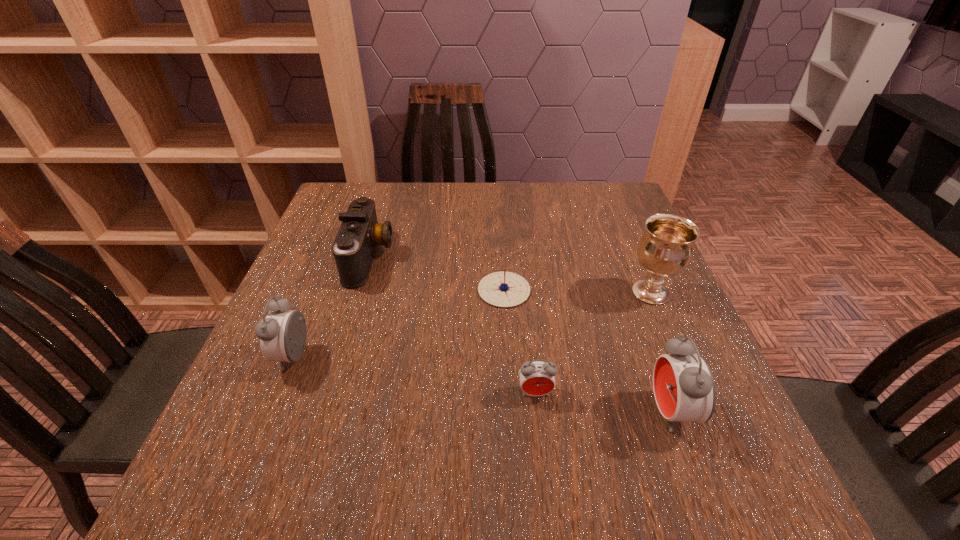
You are a GUI agent. You are given a task and a screenshot of the screen. Output one action in this format:
    pyautogui.click(x=<x>, y=<y>)
    Task: Click on the object present at the near right corner
    The height and width of the screenshot is (540, 960).
    Given the screenshot: What is the action you would take?
    pyautogui.click(x=684, y=388)

The image size is (960, 540). In the image, there is a desktop. In order to click on free region at the far edge in this screenshot , I will do `click(468, 186)`.

The image size is (960, 540). In the image, there is a desktop. Find the location of `vacant region at the near edge`. vacant region at the near edge is located at coordinates (441, 436).

Locate an element on the screen. Image resolution: width=960 pixels, height=540 pixels. vacant space at the left edge of the desktop is located at coordinates (304, 285).

In order to click on vacant position at the right edge of the desktop in this screenshot , I will do `click(606, 301)`.

In order to click on vacant space at the far left corner in this screenshot , I will do `click(326, 225)`.

Locate an element on the screen. The width and height of the screenshot is (960, 540). free space at the near left corner is located at coordinates (275, 436).

Locate an element on the screen. free spot at the far right corner of the desktop is located at coordinates (614, 194).

Locate an element on the screen. vacant area between the chalice and the second tallest alarm clock is located at coordinates (472, 325).

Where is `vacant area between the rightmost alarm clock and the second shortest object`? This screenshot has height=540, width=960. vacant area between the rightmost alarm clock and the second shortest object is located at coordinates (603, 402).